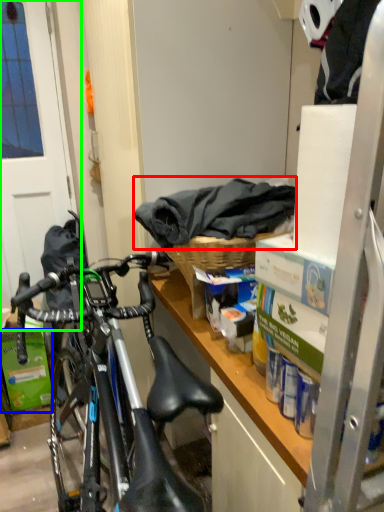
Question: Based on their relative distances, which object is nearer to material (highlighted by a red box)? Choose from box (highlighted by a blue box) and screen door (highlighted by a green box).

Choices:
 (A) box
 (B) screen door

Answer: (B)